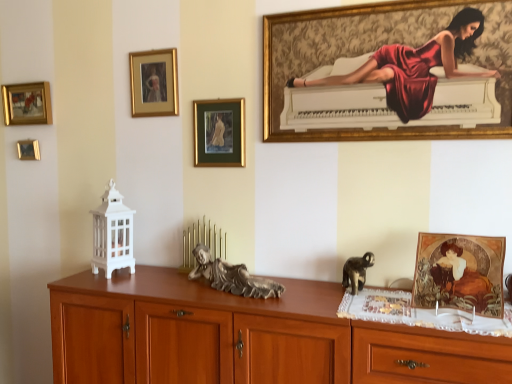
How much space does silver metallic statue at center, the 2th animal in the right-to-left sequence, occupy horizontally?

It is 8.68 inches.

Identify the location of gold-framed painting at upper center, acting as the 1th picture frame starting from the right. Image resolution: width=512 pixels, height=384 pixels. (355, 128).

What are the coordinates of `gold-framed painting at upper center, the fourth picture frame positioned from the back` in the screenshot? It's located at [219, 133].

At what (x,y) coordinates should I click in order to perform the action: click on metallic gold picture frame at upper left, which is the 1th picture frame in left-to-right order. Please return your answer as a coordinate pair (x, y). The height and width of the screenshot is (384, 512). Looking at the image, I should click on (28, 150).

Describe the element at coordinates (154, 83) in the screenshot. The image size is (512, 384). I see `gold/glossy picture frame at upper left, marked as the 3th picture frame in a back-to-front arrangement` at that location.

In order to face brown wooden chest of drawers at center, should I rotate leftwards or rightwards?

It's best to rotate left around 6.989 degrees.

Find the location of `silver metallic statue at center, the 2th animal in the right-to-left sequence`. silver metallic statue at center, the 2th animal in the right-to-left sequence is located at coordinates (232, 277).

In the scene shown: Does gold/glossy picture frame at upper left, which is the 3th picture frame in right-to-left order, have a lesser height compared to shiny metallic cat at lower right, positioned as the 1th animal in right-to-left order?

Incorrect, the height of gold/glossy picture frame at upper left, which is the 3th picture frame in right-to-left order, does not fall short of that of shiny metallic cat at lower right, positioned as the 1th animal in right-to-left order.

Which is more to the right, gold/glossy picture frame at upper left, which is the 3th picture frame in right-to-left order, or shiny metallic cat at lower right, marked as the 2th animal in a left-to-right arrangement?

Positioned to the right is shiny metallic cat at lower right, marked as the 2th animal in a left-to-right arrangement.

Is gold/glossy picture frame at upper left, arranged as the third picture frame when viewed from the left, located outside shiny metallic cat at lower right, marked as the 2th animal in a left-to-right arrangement?

Yes.

Between point (168, 84) and point (344, 287), which one is positioned behind?

The point (168, 84) is farther.

From the image's perspective, which is above, silver metallic statue at center, positioned as the first animal in left-to-right order, or gold/glossy picture frame at upper left, arranged as the third picture frame when viewed from the left?

gold/glossy picture frame at upper left, arranged as the third picture frame when viewed from the left, is shown above in the image.

From a real-world perspective, who is located lower, silver metallic statue at center, positioned as the first animal in left-to-right order, or gold/glossy picture frame at upper left, which is the 3th picture frame in right-to-left order?

silver metallic statue at center, positioned as the first animal in left-to-right order.

Between point (254, 279) and point (161, 70), which one is positioned in front?

Positioned in front is point (254, 279).

Measure the distance between silver metallic statue at center, the 2th animal in the right-to-left sequence, and gold/glossy picture frame at upper left, the third picture frame viewed from the front.

A distance of 34.73 inches exists between silver metallic statue at center, the 2th animal in the right-to-left sequence, and gold/glossy picture frame at upper left, the third picture frame viewed from the front.

Locate an element on the screen. The image size is (512, 384). the 4th picture frame behind the shiny metallic cat at lower right, positioned as the 1th animal in right-to-left order is located at coordinates (28, 150).

Considering the sizes of objects metallic gold picture frame at upper left, which is counted as the fifth picture frame, starting from the right, and shiny metallic cat at lower right, positioned as the 1th animal in right-to-left order, in the image provided, who is taller, metallic gold picture frame at upper left, which is counted as the fifth picture frame, starting from the right, or shiny metallic cat at lower right, positioned as the 1th animal in right-to-left order,?

Standing taller between the two is shiny metallic cat at lower right, positioned as the 1th animal in right-to-left order.

Considering the relative sizes of metallic gold picture frame at upper left, which is the fifth picture frame from front to back, and shiny metallic cat at lower right, positioned as the 1th animal in right-to-left order, in the image provided, is metallic gold picture frame at upper left, which is the fifth picture frame from front to back, wider than shiny metallic cat at lower right, positioned as the 1th animal in right-to-left order,?

In fact, metallic gold picture frame at upper left, which is the fifth picture frame from front to back, might be narrower than shiny metallic cat at lower right, positioned as the 1th animal in right-to-left order.

Considering the positions of objects metallic gold picture frame at upper left, the first picture frame when ordered from back to front, and shiny metallic cat at lower right, marked as the 2th animal in a left-to-right arrangement, in the image provided, who is more to the left, metallic gold picture frame at upper left, the first picture frame when ordered from back to front, or shiny metallic cat at lower right, marked as the 2th animal in a left-to-right arrangement,?

metallic gold picture frame at upper left, the first picture frame when ordered from back to front, is more to the left.

Would you say gold-framed painting at upper left, marked as the fourth picture frame in a right-to-left arrangement, contains brown wooden chest of drawers at center?

No, gold-framed painting at upper left, marked as the fourth picture frame in a right-to-left arrangement, does not contain brown wooden chest of drawers at center.

Is gold-framed painting at upper left, marked as the fourth picture frame in a right-to-left arrangement, further to camera compared to brown wooden chest of drawers at center?

Yes, the depth of gold-framed painting at upper left, marked as the fourth picture frame in a right-to-left arrangement, is greater than that of brown wooden chest of drawers at center.

Based on their sizes in the image, would you say gold-framed painting at upper left, marked as the 4th picture frame in a front-to-back arrangement, is bigger or smaller than brown wooden chest of drawers at center?

gold-framed painting at upper left, marked as the 4th picture frame in a front-to-back arrangement, is smaller than brown wooden chest of drawers at center.

Is metallic gold picture frame at upper left, which is the fifth picture frame from front to back, further to the viewer compared to brown wooden chest of drawers at center?

Yes, it is.

Is metallic gold picture frame at upper left, the first picture frame when ordered from back to front, spatially inside brown wooden chest of drawers at center, or outside of it?

The correct answer is: outside.

Can you confirm if metallic gold picture frame at upper left, which is counted as the fifth picture frame, starting from the right, is smaller than brown wooden chest of drawers at center?

Yes, metallic gold picture frame at upper left, which is counted as the fifth picture frame, starting from the right, is smaller than brown wooden chest of drawers at center.

Does metallic gold picture frame at upper left, which is the fifth picture frame from front to back, turn towards brown wooden chest of drawers at center?

No, metallic gold picture frame at upper left, which is the fifth picture frame from front to back, is not oriented towards brown wooden chest of drawers at center.

Between gold/glossy picture frame at upper left, the third picture frame viewed from the front, and gold-framed painting at upper center, which ranks as the 5th picture frame in back-to-front order, which one has smaller width?

gold/glossy picture frame at upper left, the third picture frame viewed from the front.

Based on the photo, from a real-world perspective, who is located higher, gold/glossy picture frame at upper left, marked as the 3th picture frame in a back-to-front arrangement, or gold-framed painting at upper center, which is the 5th picture frame in left-to-right order?

gold/glossy picture frame at upper left, marked as the 3th picture frame in a back-to-front arrangement, from a real-world perspective.

Between point (163, 96) and point (273, 68), which one is positioned behind?

Point (163, 96)

Do you think gold-framed painting at upper center, which is the 5th picture frame in left-to-right order, is within shiny metallic cat at lower right, positioned as the 1th animal in right-to-left order, or outside of it?

gold-framed painting at upper center, which is the 5th picture frame in left-to-right order, is not enclosed by shiny metallic cat at lower right, positioned as the 1th animal in right-to-left order.

Image resolution: width=512 pixels, height=384 pixels. In order to click on picture frame in front of the shiny metallic cat at lower right, positioned as the 1th animal in right-to-left order in this screenshot , I will do `click(355, 128)`.

From the image's perspective, between gold-framed painting at upper center, arranged as the 1th picture frame when viewed from the front, and shiny metallic cat at lower right, marked as the 2th animal in a left-to-right arrangement, which one is located above?

gold-framed painting at upper center, arranged as the 1th picture frame when viewed from the front, appears higher in the image.

Does gold-framed painting at upper center, arranged as the 1th picture frame when viewed from the front, have a larger size compared to shiny metallic cat at lower right, marked as the 2th animal in a left-to-right arrangement?

Yes.

Find the location of a particular element. The image size is (512, 384). the 2nd animal below the gold/glossy picture frame at upper left, marked as the 3th picture frame in a back-to-front arrangement (from a real-world perspective) is located at coordinates (357, 271).

From the image's perspective, starting from the silver metallic statue at center, the 2th animal in the right-to-left sequence, which picture frame is the 5th one above? Please provide its 2D coordinates.

[(154, 83)]

Based on their spatial positions, is gold-framed painting at upper center, which is the 5th picture frame in left-to-right order, or metallic gold picture frame at upper left, which is the fifth picture frame from front to back, closer to shiny metallic cat at lower right, marked as the 2th animal in a left-to-right arrangement?

gold-framed painting at upper center, which is the 5th picture frame in left-to-right order, lies closer to shiny metallic cat at lower right, marked as the 2th animal in a left-to-right arrangement, than the other object.

Based on their spatial positions, is shiny metallic cat at lower right, positioned as the 1th animal in right-to-left order, or brown wooden chest of drawers at center closer to gold/glossy picture frame at upper left, marked as the 3th picture frame in a back-to-front arrangement?

brown wooden chest of drawers at center.

Considering their positions, is metallic gold picture frame at upper left, which is counted as the fifth picture frame, starting from the right, positioned closer to gold/glossy picture frame at upper left, arranged as the third picture frame when viewed from the left, than shiny metallic cat at lower right, marked as the 2th animal in a left-to-right arrangement?

metallic gold picture frame at upper left, which is counted as the fifth picture frame, starting from the right.

Estimate the real-world distances between objects in this image. Which object is further from brown wooden chest of drawers at center, metallic gold picture frame at upper left, which is counted as the fifth picture frame, starting from the right, or gold-framed painting at upper center, which ranks as the 5th picture frame in back-to-front order?

metallic gold picture frame at upper left, which is counted as the fifth picture frame, starting from the right, lies further to brown wooden chest of drawers at center than the other object.

Looking at the image, which one is located closer to shiny metallic cat at lower right, marked as the 2th animal in a left-to-right arrangement, gold-framed painting at upper left, which ranks as the second picture frame in left-to-right order, or gold-framed painting at upper center, which ranks as the second picture frame in front-to-back order?

Based on the image, gold-framed painting at upper center, which ranks as the second picture frame in front-to-back order, appears to be nearer to shiny metallic cat at lower right, marked as the 2th animal in a left-to-right arrangement.

Based on their spatial positions, is gold-framed painting at upper center, which ranks as the 5th picture frame in back-to-front order, or wooden drawer at lower right further from brown wooden chest of drawers at center?

gold-framed painting at upper center, which ranks as the 5th picture frame in back-to-front order.

From the image, which object appears to be nearer to wooden drawer at lower right, shiny metallic cat at lower right, marked as the 2th animal in a left-to-right arrangement, or gold-framed painting at upper center, the fourth picture frame positioned from the back?

shiny metallic cat at lower right, marked as the 2th animal in a left-to-right arrangement, is positioned closer to the anchor wooden drawer at lower right.

Which object lies further to the anchor point metallic gold picture frame at upper left, which is the fifth picture frame from front to back, gold/glossy picture frame at upper left, arranged as the third picture frame when viewed from the left, or shiny metallic cat at lower right, marked as the 2th animal in a left-to-right arrangement?

Based on the image, shiny metallic cat at lower right, marked as the 2th animal in a left-to-right arrangement, appears to be further to metallic gold picture frame at upper left, which is the fifth picture frame from front to back.

The height and width of the screenshot is (384, 512). I want to click on the chest of drawers situated between gold-framed painting at upper left, marked as the 4th picture frame in a front-to-back arrangement, and gold-framed painting at upper center, which is the 5th picture frame in left-to-right order, from left to right, so click(246, 337).

I want to click on chest of drawers between metallic gold picture frame at upper left, which is the fifth picture frame from front to back, and wooden drawer at lower right, in the horizontal direction, so click(x=246, y=337).

The height and width of the screenshot is (384, 512). Find the location of `animal situated between silver metallic statue at center, the 2th animal in the right-to-left sequence, and wooden drawer at lower right from left to right`. animal situated between silver metallic statue at center, the 2th animal in the right-to-left sequence, and wooden drawer at lower right from left to right is located at coordinates (357, 271).

In order to click on chest of drawers between metallic gold picture frame at upper left, the first picture frame when ordered from back to front, and silver metallic statue at center, positioned as the first animal in left-to-right order, in the horizontal direction in this screenshot , I will do `click(246, 337)`.